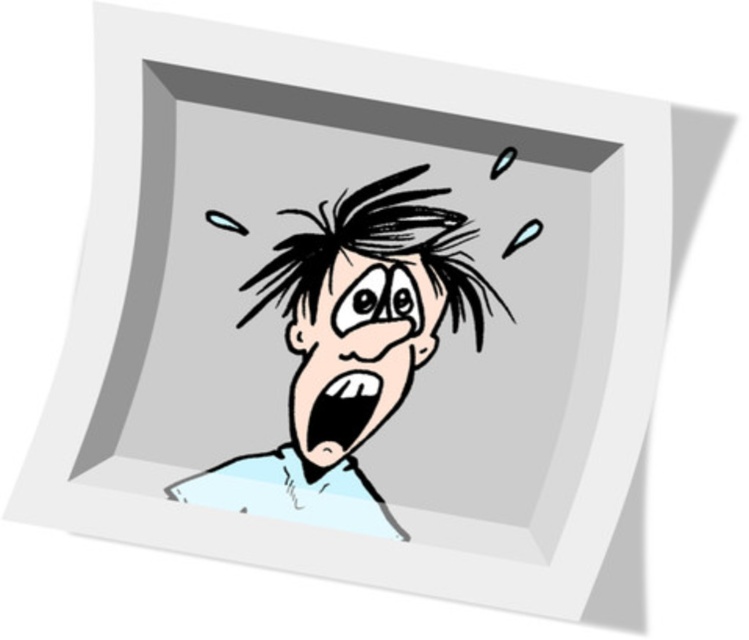
Does black spiky hair at center appear under black glossy mouth at center?

No, black spiky hair at center is not below black glossy mouth at center.

Is black spiky hair at center further to camera compared to black glossy mouth at center?

No, black spiky hair at center is closer to the viewer.

Is point (345, 253) positioned in front of point (339, 420)?

Yes, point (345, 253) is closer to viewer.

Identify the location of black spiky hair at center. point(377,250).

Who is higher up, light blue paper at center or black spiky hair at center?

Positioned higher is black spiky hair at center.

Identify the location of light blue paper at center. (351, 342).

Between point (395, 284) and point (357, 387), which one is positioned behind?

The point (395, 284) is more distant.

Which is more to the left, light blue paper at center or black matte mouth at center?

light blue paper at center

Locate an element on the screen. light blue paper at center is located at coordinates (351, 342).